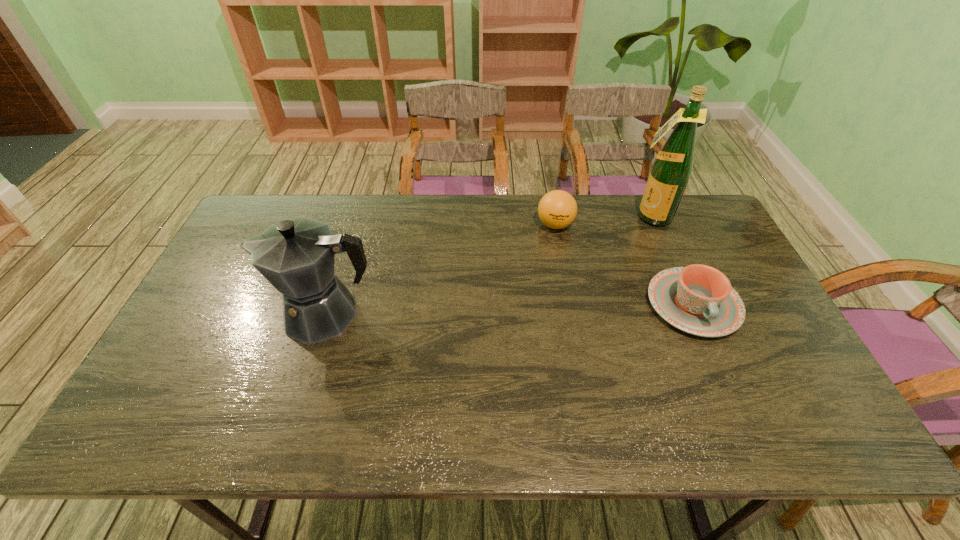
You are a GUI agent. You are given a task and a screenshot of the screen. Output one action in this format:
    pyautogui.click(x=<x>, y=<y>)
    Task: Click on the empty space between the shortest object and the liquor
    The image size is (960, 540).
    Given the screenshot: What is the action you would take?
    pyautogui.click(x=671, y=260)

This screenshot has width=960, height=540. In order to click on free area in between the liquor and the chinaware in this screenshot , I will do pos(671,260).

Where is `free point between the liquor and the third shortest object`? free point between the liquor and the third shortest object is located at coordinates (488, 265).

You are a GUI agent. You are given a task and a screenshot of the screen. Output one action in this format:
    pyautogui.click(x=<x>, y=<y>)
    Task: Click on the empty space between the third tallest object and the tallest object
    
    Given the screenshot: What is the action you would take?
    pyautogui.click(x=603, y=220)

The width and height of the screenshot is (960, 540). Identify the location of vacant area between the tallest object and the leftmost object. (488, 265).

Select which object appears as the third closest to the leftmost object. Please provide its 2D coordinates. Your answer should be formatted as a tuple, i.e. [(x, y)], where the tuple contains the x and y coordinates of a point satisfying the conditions above.

[(671, 170)]

Locate which object is the second closest to the chinaware. Please provide its 2D coordinates. Your answer should be formatted as a tuple, i.e. [(x, y)], where the tuple contains the x and y coordinates of a point satisfying the conditions above.

[(557, 209)]